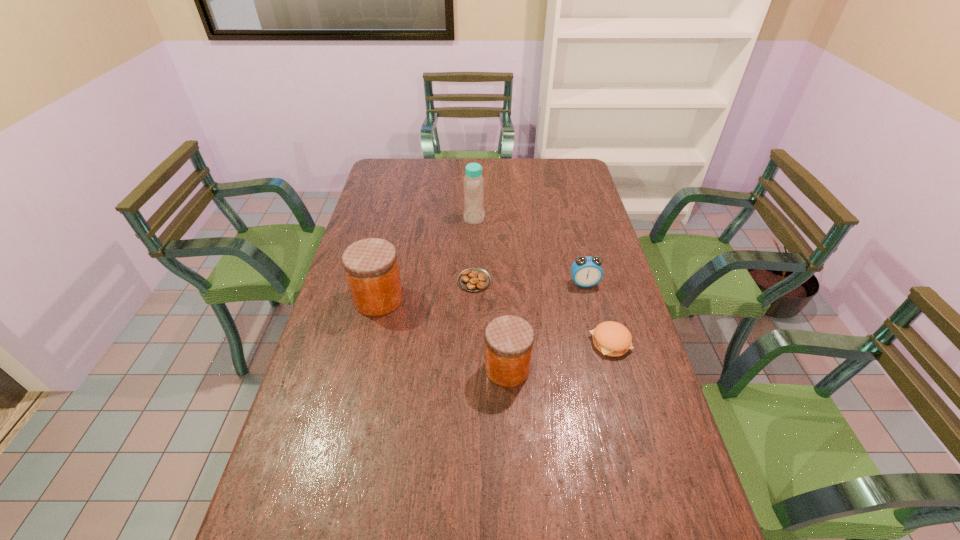
Locate an element on the screen. This screenshot has width=960, height=540. the fifth shortest object is located at coordinates (371, 267).

The image size is (960, 540). Find the location of `the leftmost object`. the leftmost object is located at coordinates (371, 267).

In order to click on the right jar in this screenshot , I will do `click(509, 339)`.

Where is `the nearer jar`? the nearer jar is located at coordinates (509, 339).

This screenshot has width=960, height=540. What are the coordinates of `alarm clock` in the screenshot? It's located at (587, 271).

Locate an element on the screen. The image size is (960, 540). bottle is located at coordinates (474, 213).

The height and width of the screenshot is (540, 960). Find the location of `the tallest object`. the tallest object is located at coordinates (474, 213).

Locate an element on the screen. This screenshot has width=960, height=540. the fifth tallest object is located at coordinates (611, 338).

Where is `the shortest object`? The image size is (960, 540). the shortest object is located at coordinates [474, 279].

The image size is (960, 540). In order to click on vacant space located 0.070m on the right of the farther jar in this screenshot , I will do `click(425, 299)`.